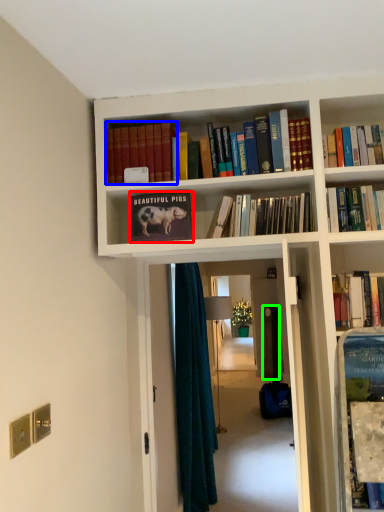
Question: Which object is the farthest from book (highlighted by a red box)? Choose among these: book (highlighted by a blue box) or door (highlighted by a green box).

Choices:
 (A) book
 (B) door

Answer: (B)